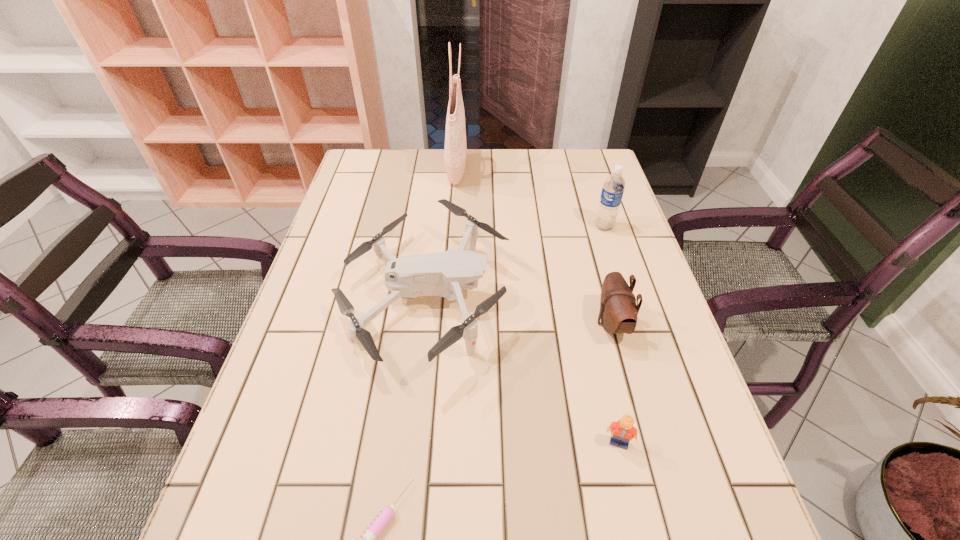
Locate an element on the screen. free space located 0.170m with the flap open on the pouch is located at coordinates (520, 323).

At what (x,y) coordinates should I click in order to perform the action: click on free location located with the flap open on the pouch. Please return your answer as a coordinate pair (x, y). Looking at the image, I should click on (453, 323).

Locate an element on the screen. This screenshot has height=540, width=960. vacant space located with the flap open on the pouch is located at coordinates (440, 323).

You are a GUI agent. You are given a task and a screenshot of the screen. Output one action in this format:
    pyautogui.click(x=<x>, y=<y>)
    Task: Click on the vacant space located with a camera at the front of the drone
    Image resolution: width=960 pixels, height=540 pixels.
    Given the screenshot: What is the action you would take?
    pyautogui.click(x=543, y=300)

You are a GUI agent. You are given a task and a screenshot of the screen. Output one action in this format:
    pyautogui.click(x=<x>, y=<y>)
    Task: Click on the free region located 0.110m on the front-facing side of the second nearest object
    The width and height of the screenshot is (960, 540).
    Given the screenshot: What is the action you would take?
    coord(636,517)

Find the location of a particular element. The image size is (960, 540). object present at the far edge is located at coordinates (455, 150).

The image size is (960, 540). Identify the location of object that is at the left edge. (444, 274).

The height and width of the screenshot is (540, 960). What are the coordinates of `water bottle that is at the right edge` in the screenshot? It's located at (613, 188).

This screenshot has height=540, width=960. I want to click on pouch that is at the right edge, so click(618, 312).

Where is `Lego that is at the right edge`? This screenshot has width=960, height=540. Lego that is at the right edge is located at coordinates (623, 430).